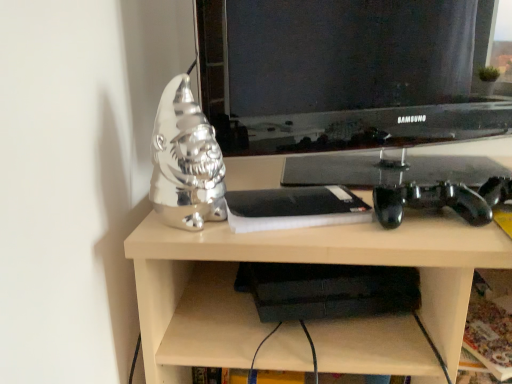
Question: Is matte black television at center at the left side of shiny silver gnome at left?

Choices:
 (A) no
 (B) yes

Answer: (A)

Question: From the image's perspective, is matte black television at center located beneath shiny silver gnome at left?

Choices:
 (A) yes
 (B) no

Answer: (B)

Question: Is matte black television at center shorter than shiny silver gnome at left?

Choices:
 (A) no
 (B) yes

Answer: (A)

Question: Is the depth of matte black television at center greater than that of shiny silver gnome at left?

Choices:
 (A) no
 (B) yes

Answer: (B)

Question: From the image's perspective, would you say matte black television at center is positioned over shiny silver gnome at left?

Choices:
 (A) no
 (B) yes

Answer: (B)

Question: Is matte black television at center oriented towards shiny silver gnome at left?

Choices:
 (A) yes
 (B) no

Answer: (A)

Question: Considering the relative sizes of shiny silver gnome at left and matte black television at center in the image provided, is shiny silver gnome at left wider than matte black television at center?

Choices:
 (A) no
 (B) yes

Answer: (B)

Question: From the image's perspective, would you say shiny silver gnome at left is shown under matte black television at center?

Choices:
 (A) no
 (B) yes

Answer: (B)

Question: Does shiny silver gnome at left come behind matte black television at center?

Choices:
 (A) no
 (B) yes

Answer: (A)

Question: From the image's perspective, is shiny silver gnome at left on top of matte black television at center?

Choices:
 (A) yes
 (B) no

Answer: (B)

Question: Would you say shiny silver gnome at left is outside matte black television at center?

Choices:
 (A) yes
 (B) no

Answer: (A)

Question: Is matte black television at center located within shiny silver gnome at left?

Choices:
 (A) yes
 (B) no

Answer: (B)

Question: Can you confirm if shiny silver gnome at left is positioned to the right of metallic silver gnome at left?

Choices:
 (A) yes
 (B) no

Answer: (B)